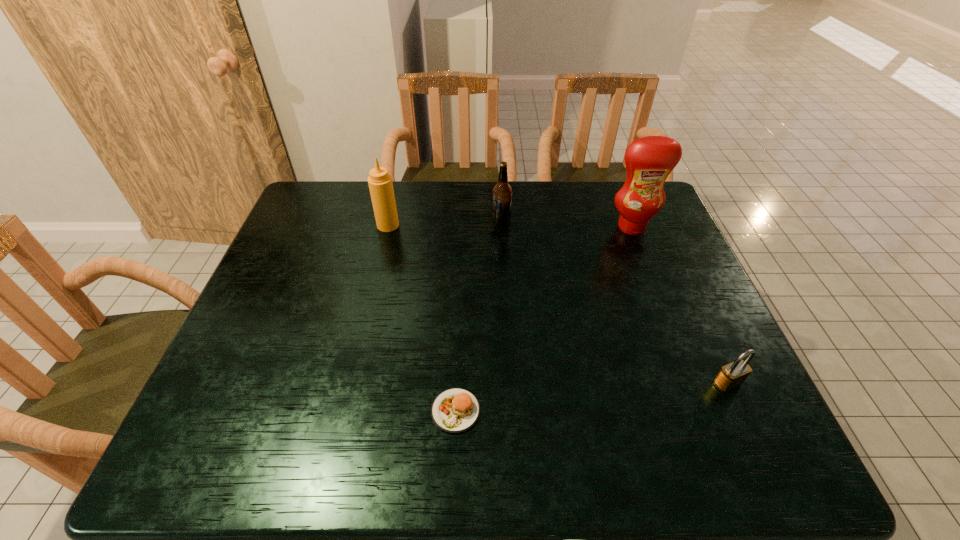
The width and height of the screenshot is (960, 540). In order to click on the taller condiment in this screenshot , I will do `click(649, 160)`.

Identify the location of the right condiment. The width and height of the screenshot is (960, 540). (649, 160).

Identify the location of the shorter condiment. (380, 183).

You are a GUI agent. You are given a task and a screenshot of the screen. Output one action in this format:
    pyautogui.click(x=<x>, y=<y>)
    Task: Click on the leftmost object
    
    Given the screenshot: What is the action you would take?
    pyautogui.click(x=380, y=183)

Image resolution: width=960 pixels, height=540 pixels. I want to click on beer bottle, so click(502, 192).

Image resolution: width=960 pixels, height=540 pixels. Find the location of `the fourth tallest object`. the fourth tallest object is located at coordinates (732, 375).

The width and height of the screenshot is (960, 540). What are the coordinates of `the second object from left to right` in the screenshot? It's located at (455, 410).

Locate an element on the screen. The width and height of the screenshot is (960, 540). the shortest object is located at coordinates (455, 410).

The height and width of the screenshot is (540, 960). Find the location of `vacant space located on the label side of the right condiment`. vacant space located on the label side of the right condiment is located at coordinates (666, 315).

You are a GUI agent. You are given a task and a screenshot of the screen. Output one action in this format:
    pyautogui.click(x=<x>, y=<y>)
    Task: Click on the vacant position located 0.260m on the left of the shorter condiment
    This screenshot has width=960, height=540.
    Given the screenshot: What is the action you would take?
    pyautogui.click(x=293, y=225)